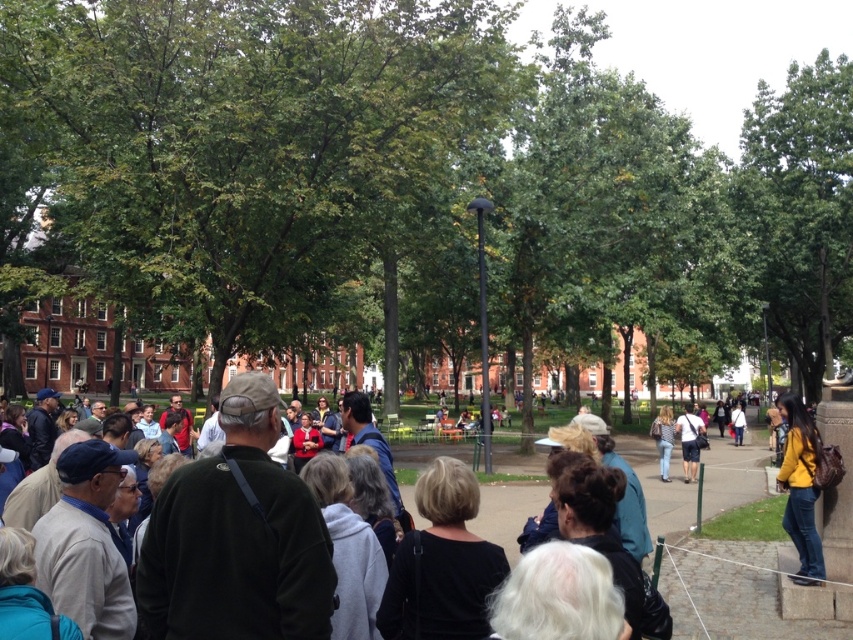
Question: Among these points, which one is nearest to the camera?

Choices:
 (A) (428, 538)
 (B) (683, 435)
 (C) (668, 413)

Answer: (A)

Question: Among these points, which one is nearest to the camera?

Choices:
 (A) (354, 16)
 (B) (218, 618)
 (C) (811, 266)
 (D) (694, 467)

Answer: (B)

Question: Which point is closer to the camera taking this photo?

Choices:
 (A) (850, 246)
 (B) (442, 588)
 (C) (320, 566)
 (D) (169, 68)

Answer: (C)

Question: Is green leafy tree at center behind denim jeans at center?

Choices:
 (A) yes
 (B) no

Answer: (B)

Question: Is dark green sweater at center further to the viewer compared to black matte jacket at center?

Choices:
 (A) yes
 (B) no

Answer: (B)

Question: Is green leafy tree at upper right positioned before denim shorts at center?

Choices:
 (A) no
 (B) yes

Answer: (A)